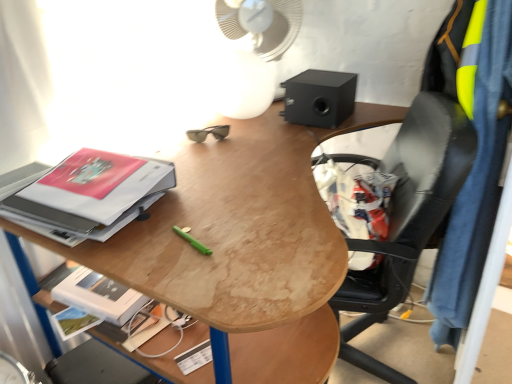
Question: Does black matte speaker at upper right have a lesser width compared to wooden desk at center?

Choices:
 (A) no
 (B) yes

Answer: (B)

Question: Is black matte speaker at upper right positioned with its back to wooden desk at center?

Choices:
 (A) yes
 (B) no

Answer: (B)

Question: Is black matte speaker at upper right not within wooden desk at center?

Choices:
 (A) no
 (B) yes

Answer: (B)

Question: Would you say black matte speaker at upper right is a long distance from wooden desk at center?

Choices:
 (A) yes
 (B) no

Answer: (B)

Question: Is black matte speaker at upper right next to wooden desk at center?

Choices:
 (A) no
 (B) yes

Answer: (A)

Question: From a real-world perspective, is wooden desk at center above or below white plastic mechanical fan at upper center?

Choices:
 (A) below
 (B) above

Answer: (A)

Question: Does point (334, 254) appear closer or farther from the camera than point (251, 64)?

Choices:
 (A) closer
 (B) farther

Answer: (A)

Question: In the image, is wooden desk at center on the left side or the right side of white plastic mechanical fan at upper center?

Choices:
 (A) right
 (B) left

Answer: (A)

Question: Is wooden desk at center wider or thinner than white plastic mechanical fan at upper center?

Choices:
 (A) thin
 (B) wide

Answer: (B)

Question: Does point (83, 177) appear closer or farther from the camera than point (252, 105)?

Choices:
 (A) farther
 (B) closer

Answer: (B)

Question: Looking at the image, does matte hardcover book at left seem bigger or smaller compared to white plastic mechanical fan at upper center?

Choices:
 (A) small
 (B) big

Answer: (A)

Question: Is matte hardcover book at left in front of or behind white plastic mechanical fan at upper center in the image?

Choices:
 (A) behind
 (B) front

Answer: (B)

Question: From the image's perspective, is matte hardcover book at left above or below white plastic mechanical fan at upper center?

Choices:
 (A) below
 (B) above

Answer: (A)

Question: From a real-world perspective, is wooden desk at center positioned above or below matte hardcover book at left?

Choices:
 (A) below
 (B) above

Answer: (A)

Question: In terms of size, does wooden desk at center appear bigger or smaller than matte hardcover book at left?

Choices:
 (A) big
 (B) small

Answer: (A)